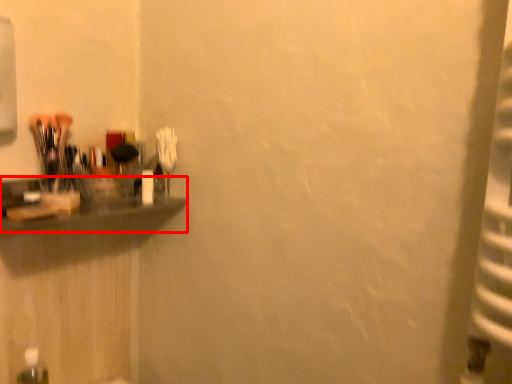
Question: Where is shelf (annotated by the red box) located in relation to bottle in the image?

Choices:
 (A) left
 (B) right

Answer: (B)